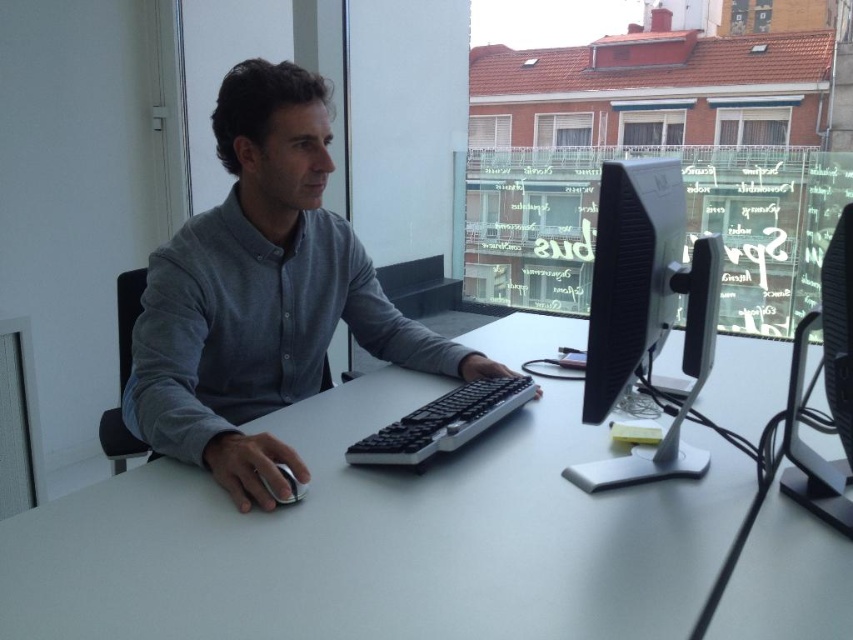
Which is behind, point (230, 488) or point (413, 422)?

Positioned behind is point (413, 422).

Is gray matte shirt at center above black plastic keyboard at center?

Yes, gray matte shirt at center is above black plastic keyboard at center.

Between point (259, 502) and point (517, 390), which one is positioned in front?

Point (259, 502)

Where is `gray matte shirt at center`? This screenshot has height=640, width=853. gray matte shirt at center is located at coordinates [262, 294].

Based on the photo, measure the distance between gray matte shirt at center and camera.

The distance of gray matte shirt at center from camera is 1.02 meters.

Can you confirm if gray matte shirt at center is positioned to the left of white glossy mouse at lower left?

Indeed, gray matte shirt at center is positioned on the left side of white glossy mouse at lower left.

The image size is (853, 640). What do you see at coordinates (262, 294) in the screenshot?
I see `gray matte shirt at center` at bounding box center [262, 294].

Where is `gray matte shirt at center`? gray matte shirt at center is located at coordinates (262, 294).

Does white matte table at center come in front of white glossy mouse at lower left?

That is True.

Can you confirm if white matte table at center is positioned to the left of white glossy mouse at lower left?

Incorrect, white matte table at center is not on the left side of white glossy mouse at lower left.

Is point (169, 556) less distant than point (297, 481)?

Yes, it is.

In order to click on white matte table at center in this screenshot , I will do point(381,540).